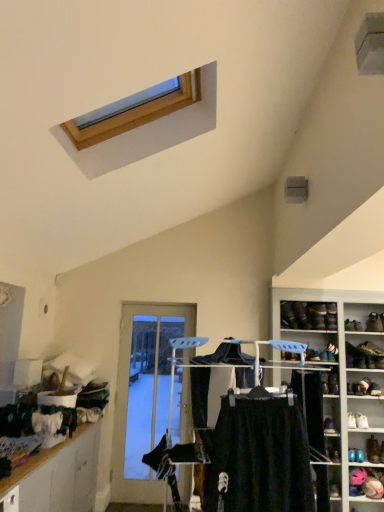
Question: Is black fabric clothes at center to the left of leather boot at right, the 5th shoe in the bottom-to-top sequence, from the viewer's perspective?

Choices:
 (A) no
 (B) yes

Answer: (B)

Question: From a real-world perspective, does black fabric clothes at center stand above leather boot at right, positioned as the fourth shoe in left-to-right order?

Choices:
 (A) no
 (B) yes

Answer: (A)

Question: Can we say black fabric clothes at center lies outside leather boot at right, positioned as the fourth shoe in left-to-right order?

Choices:
 (A) no
 (B) yes

Answer: (B)

Question: Are black fabric clothes at center and leather boot at right, marked as the third shoe in a top-to-bottom arrangement, located far from each other?

Choices:
 (A) yes
 (B) no

Answer: (A)

Question: Does black fabric clothes at center touch leather boot at right, the 4th shoe in the right-to-left sequence?

Choices:
 (A) yes
 (B) no

Answer: (B)

Question: Based on their sizes in the image, would you say leather brown shoe at center right, which is the 3th shoe from left to right, is bigger or smaller than black fabric clothes at center?

Choices:
 (A) small
 (B) big

Answer: (A)

Question: Relative to black fabric clothes at center, is leather brown shoe at center right, acting as the 5th shoe starting from the right, in front or behind?

Choices:
 (A) behind
 (B) front

Answer: (A)

Question: Is leather brown shoe at center right, placed as the fifth shoe when sorted from top to bottom, spatially inside black fabric clothes at center, or outside of it?

Choices:
 (A) outside
 (B) inside

Answer: (A)

Question: Is leather brown shoe at center right, placed as the fifth shoe when sorted from top to bottom, taller or shorter than black fabric clothes at center?

Choices:
 (A) short
 (B) tall

Answer: (A)

Question: In terms of height, does black leather shoe at upper right, arranged as the 7th shoe when viewed from the right, look taller or shorter compared to black fabric clothes at center?

Choices:
 (A) tall
 (B) short

Answer: (B)

Question: In terms of width, does black leather shoe at upper right, the 1th shoe positioned from the left, look wider or thinner when compared to black fabric clothes at center?

Choices:
 (A) wide
 (B) thin

Answer: (B)

Question: From the image's perspective, is black leather shoe at upper right, which is counted as the 2th shoe, starting from the top, located above or below black fabric clothes at center?

Choices:
 (A) below
 (B) above

Answer: (B)

Question: From a real-world perspective, is black leather shoe at upper right, which is counted as the 2th shoe, starting from the top, positioned above or below black fabric clothes at center?

Choices:
 (A) above
 (B) below

Answer: (A)

Question: Choose the correct answer: Is black matte skirt at center inside wooden cabinet at lower left or outside it?

Choices:
 (A) outside
 (B) inside

Answer: (A)

Question: From a real-world perspective, relative to wooden cabinet at lower left, is black matte skirt at center vertically above or below?

Choices:
 (A) below
 (B) above

Answer: (B)